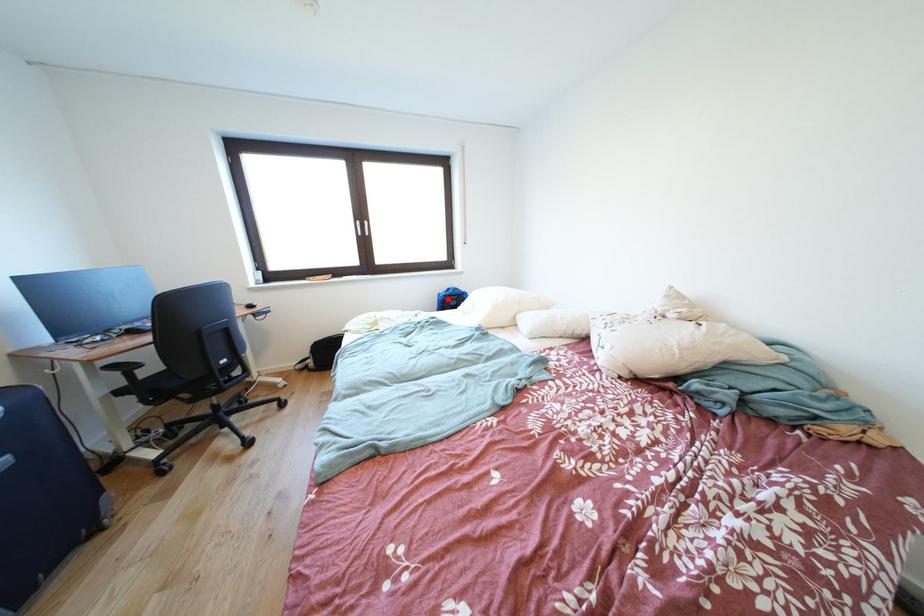
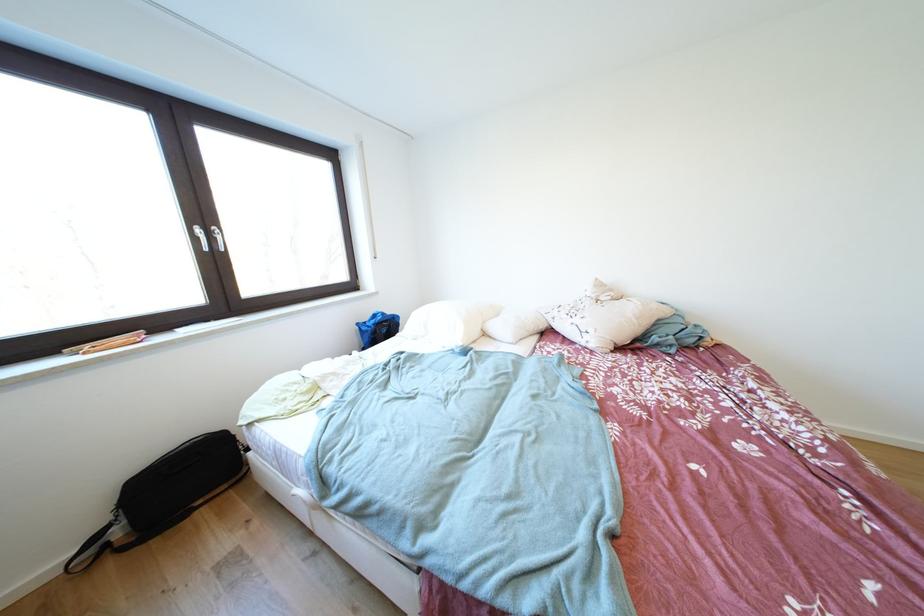
Where in the second image is the point corresponding to the highlighted location from the first image?

(367, 329)